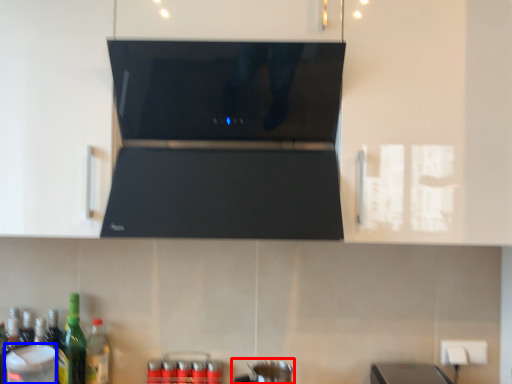
Question: Which of the following is the farthest to the observer, appliance (highlighted by a red box) or appliance (highlighted by a blue box)?

Choices:
 (A) appliance
 (B) appliance

Answer: (A)